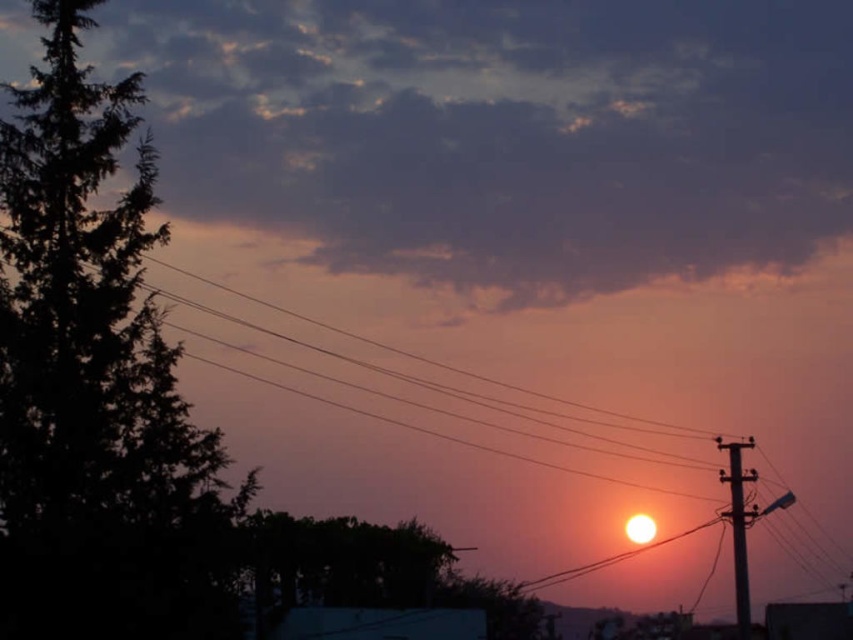
You are an artist planning to paint this sunset scene. You want to ensure the dark green leafy tree at left and the metallic gray telegraph pole at right are proportionally accurate. Which object should you draw wider in your painting?

The dark green leafy tree at left should be drawn wider in the painting because its width is larger than the metallic gray telegraph pole at right.

You are an electrician assessing the scene. You notice the metallic wires at right and the metallic gray telegraph pole at right. Which object is located to the left of the other?

The metallic wires at right is positioned on the left side of metallic gray telegraph pole at right.